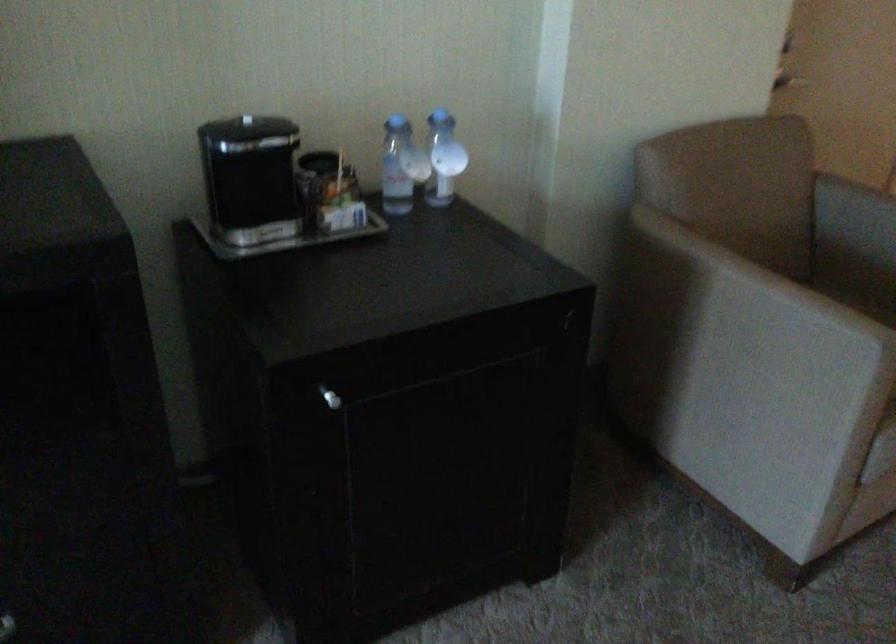
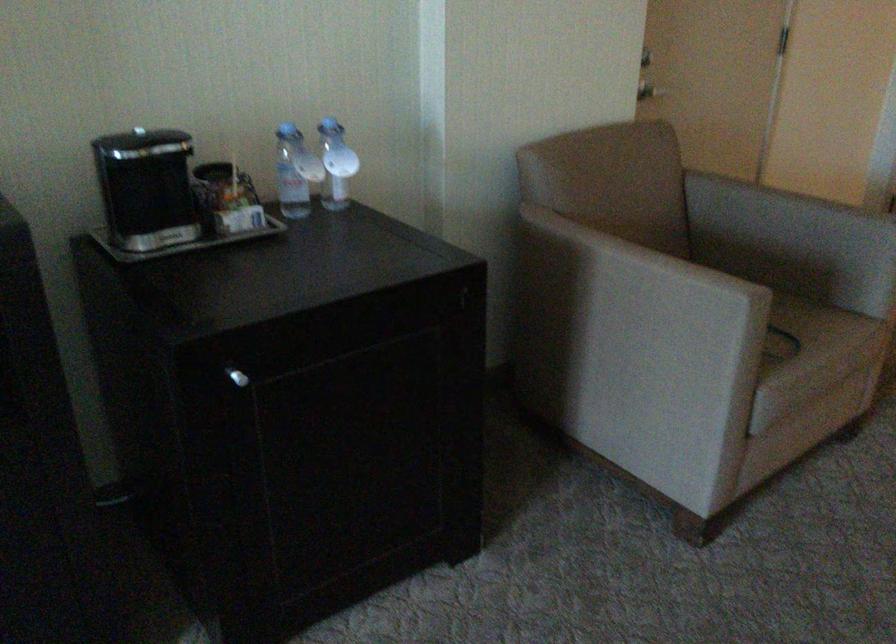
The point at (x=748, y=312) is marked in the first image. Where is the corresponding point in the second image?

(631, 283)